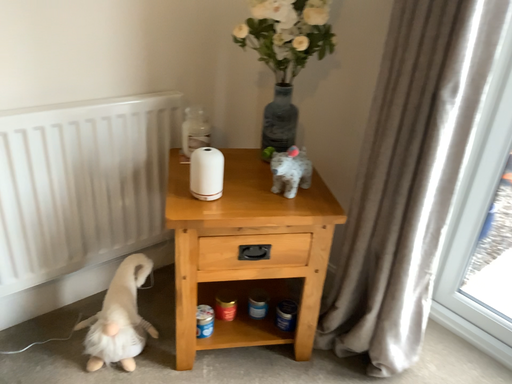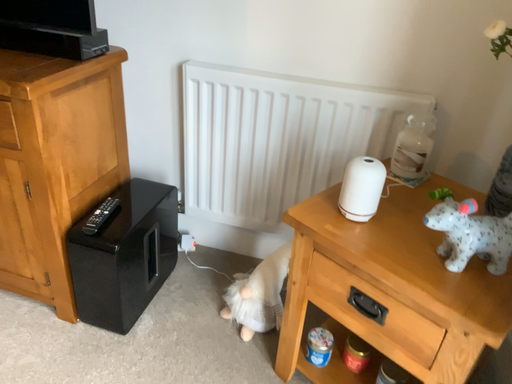
Question: How did the camera likely rotate when shooting the video?

Choices:
 (A) rotated downward
 (B) rotated upward

Answer: (B)